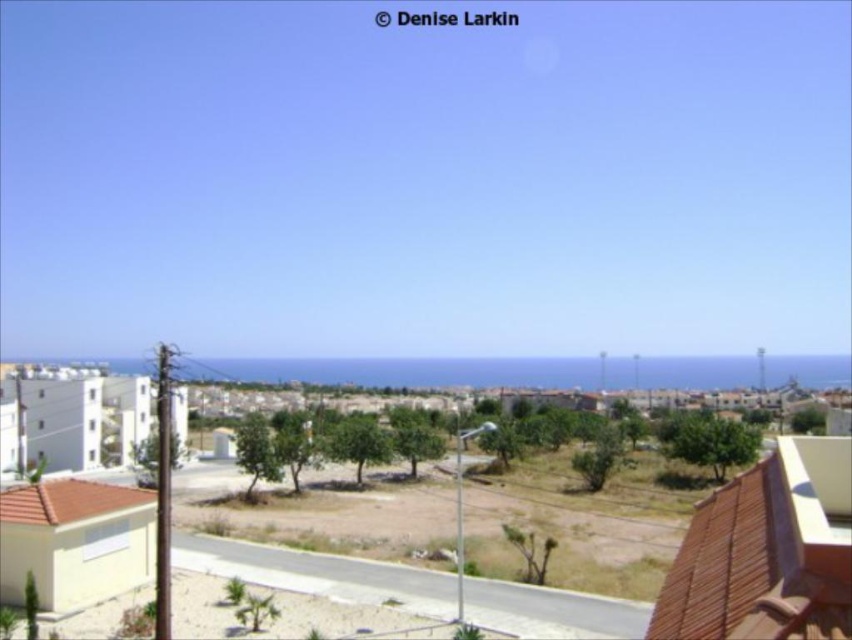
You are standing at the point with coordinates point (766, 552) in the coastal residential area. What can you see at that location?

At point (766, 552), there is a brown tile balcony at lower right.

You are standing on the brown tile balcony at lower right and looking towards the blue ocean at center. Which object appears taller from your perspective?

The blue ocean at center appears taller than the brown tile balcony at lower right because the brown tile balcony at lower right has a lesser height compared to blue ocean at center.

You are a real estate agent showing a potential buyer the view from a property. You point out the brown tile balcony at lower right and the blue ocean at center. The buyer asks if the balcony takes up more of the view than the ocean. How do you respond?

The brown tile balcony at lower right occupies less space than the blue ocean at center, so the ocean takes up more of the view than the balcony.